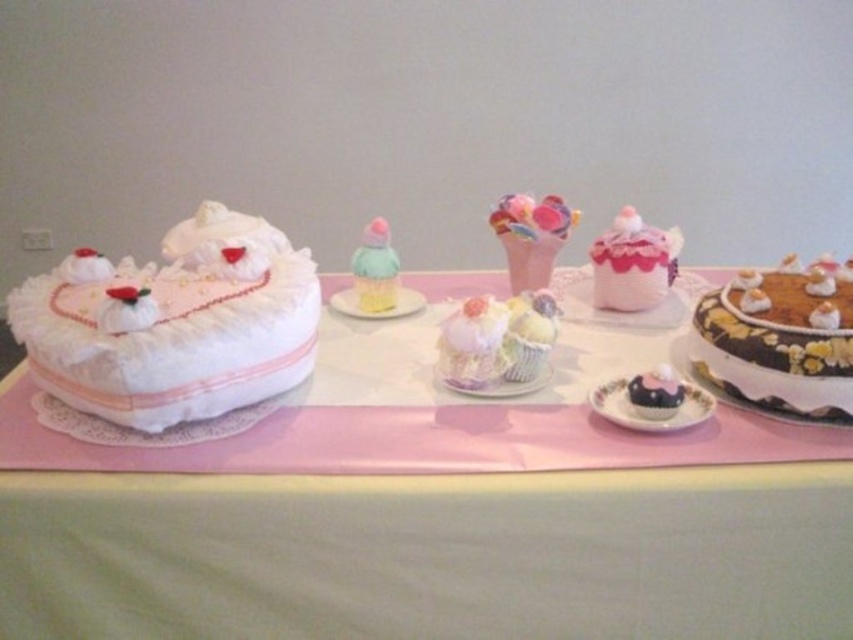
Who is higher up, white lace cake at left or pastel fluffy cupcake at center?

pastel fluffy cupcake at center is higher up.

Which of these two, white lace cake at left or pastel fluffy cupcake at center, stands taller?

white lace cake at left

What do you see at coordinates (422, 532) in the screenshot?
I see `white lace cake at left` at bounding box center [422, 532].

Where is `white lace cake at left`? The width and height of the screenshot is (853, 640). white lace cake at left is located at coordinates (422, 532).

Is pink fabric cupcake at center below chocolate frosted cupcake at lower right?

Actually, pink fabric cupcake at center is above chocolate frosted cupcake at lower right.

How far apart are pink fabric cupcake at center and chocolate frosted cupcake at lower right?

12.57 inches

Locate an element on the screen. This screenshot has width=853, height=640. pink fabric cupcake at center is located at coordinates (633, 262).

Where is `pink fabric cupcake at center`? This screenshot has width=853, height=640. pink fabric cupcake at center is located at coordinates coord(633,262).

Does pink fabric cupcake at center have a larger size compared to chocolate matte cupcake at lower right?

Indeed, pink fabric cupcake at center has a larger size compared to chocolate matte cupcake at lower right.

Who is more forward, (665, 244) or (688, 403)?

Positioned in front is point (688, 403).

Locate an element on the screen. The width and height of the screenshot is (853, 640). pink fabric cupcake at center is located at coordinates (633, 262).